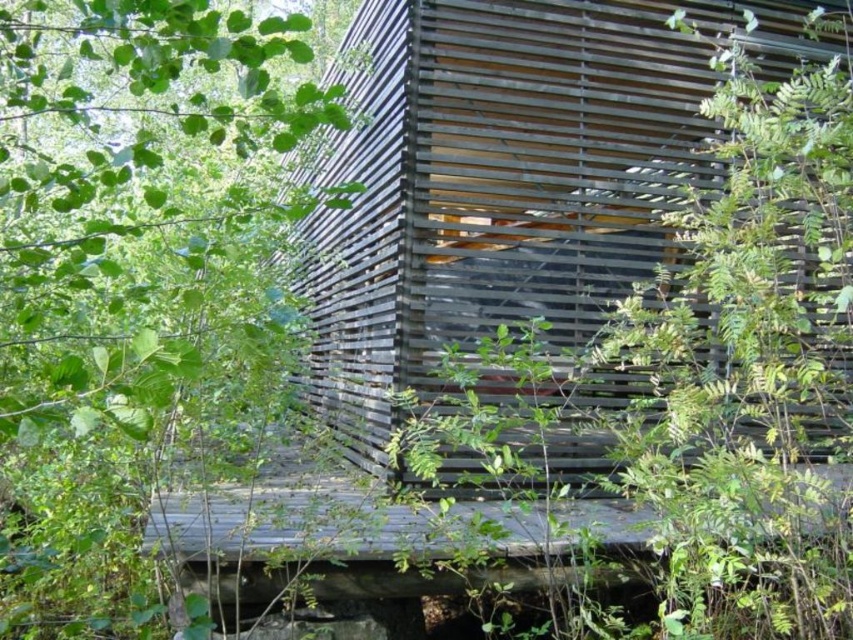
Question: Is green leafy tree at left bigger than weathered wood hut at center?

Choices:
 (A) no
 (B) yes

Answer: (B)

Question: Can you confirm if green leafy tree at left is thinner than weathered wood hut at center?

Choices:
 (A) no
 (B) yes

Answer: (B)

Question: Which point is farther from the camera taking this photo?

Choices:
 (A) (216, 394)
 (B) (300, 157)

Answer: (B)

Question: Can you confirm if green leafy tree at left is thinner than weathered wood hut at center?

Choices:
 (A) yes
 (B) no

Answer: (A)